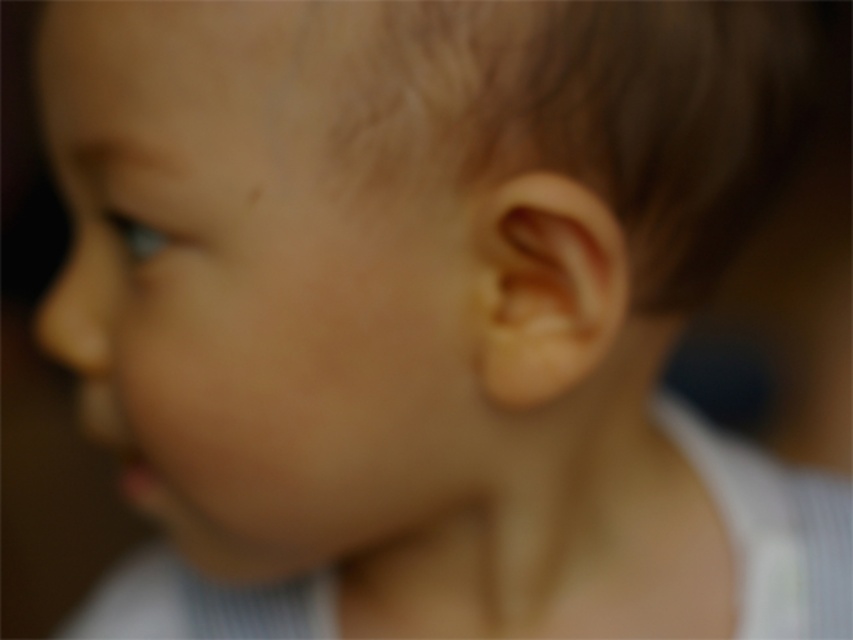
Does smooth skin face at center appear under brown fuzzy hair at upper right?

Indeed, smooth skin face at center is positioned under brown fuzzy hair at upper right.

Describe the element at coordinates (251, 292) in the screenshot. I see `smooth skin face at center` at that location.

Identify the location of smooth skin face at center. (251, 292).